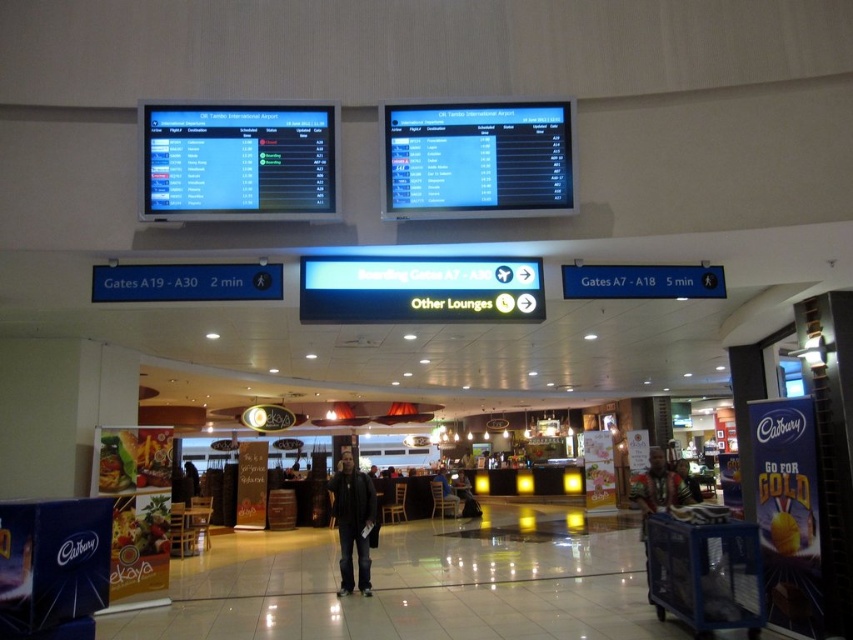
Can you confirm if dark gray jacket at center is positioned below wooden tribal mask at center?

Actually, dark gray jacket at center is above wooden tribal mask at center.

Does dark gray jacket at center have a lesser width compared to wooden tribal mask at center?

Yes, dark gray jacket at center is thinner than wooden tribal mask at center.

Where is `dark gray jacket at center`? Image resolution: width=853 pixels, height=640 pixels. dark gray jacket at center is located at coordinates (352, 522).